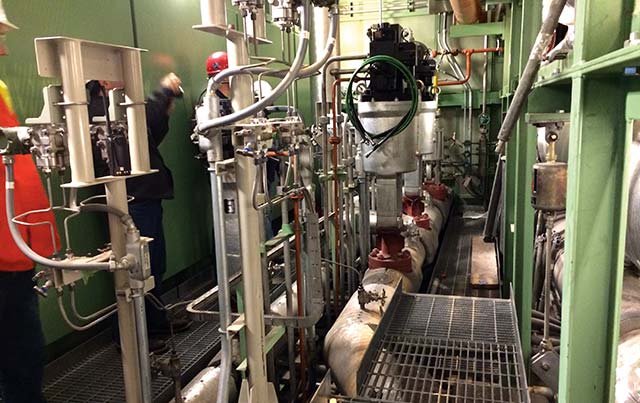
You are a GUI agent. You are given a task and a screenshot of the screen. Output one action in this format:
    pyautogui.click(x=<x>, y=<y>)
    Task: Click on the floor
    The width and height of the screenshot is (640, 403).
    Given the screenshot: What is the action you would take?
    pyautogui.click(x=105, y=388)